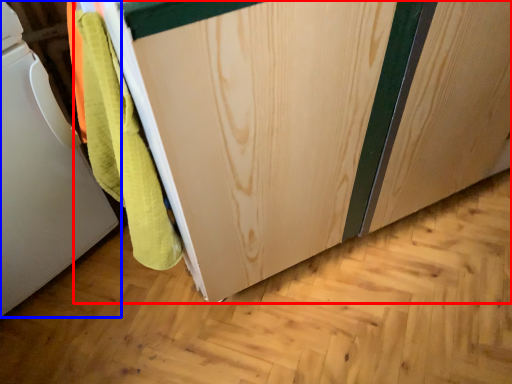
Question: Which point is closer to the camera, cabinetry (highlighted by a red box) or home appliance (highlighted by a blue box)?

Choices:
 (A) cabinetry
 (B) home appliance

Answer: (A)